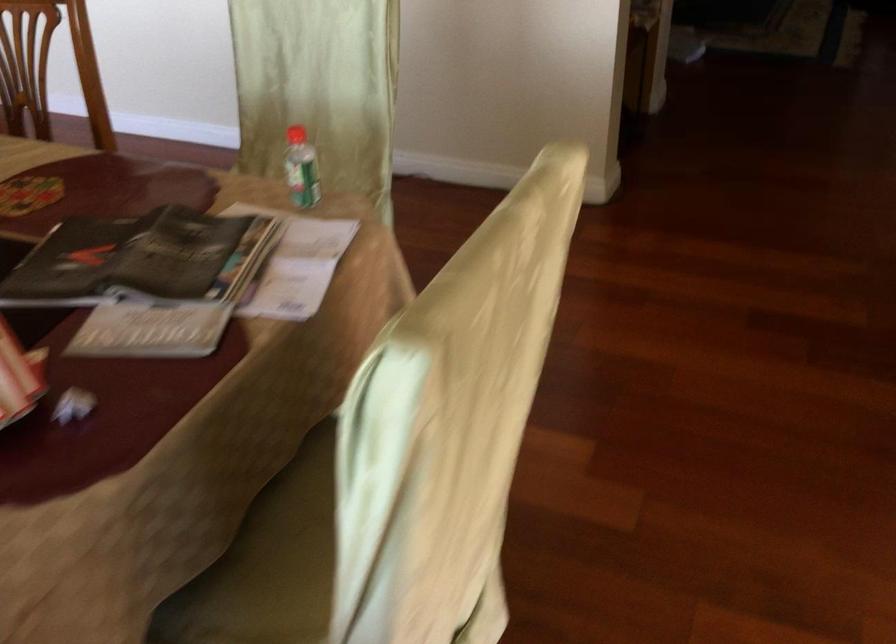
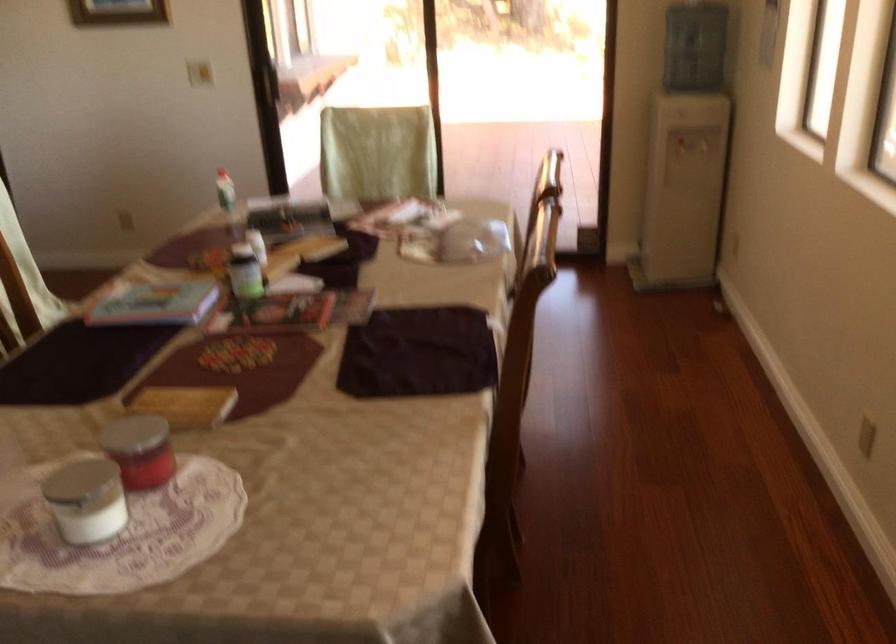
Where in the second image is the point corresponding to (x=290, y=172) from the first image?

(225, 190)